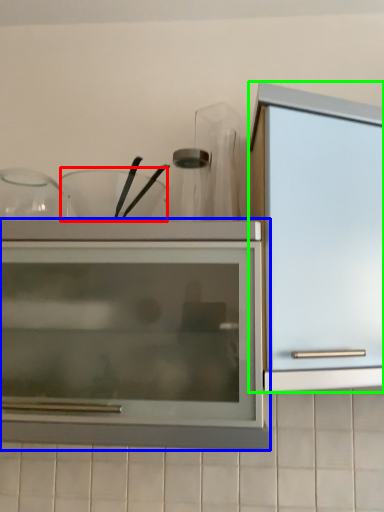
Question: Based on their relative distances, which object is nearer to tableware (highlighted by a red box)? Choose from cupboard (highlighted by a blue box) and cabinetry (highlighted by a green box).

Choices:
 (A) cupboard
 (B) cabinetry

Answer: (A)